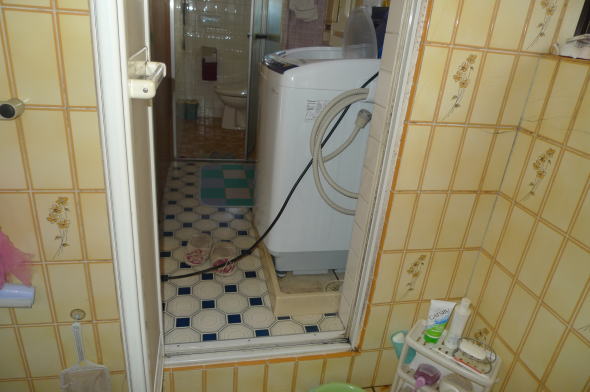
At what (x,y) coordinates should I click in order to perform the action: click on toilet. Please return your answer as a coordinate pair (x, y). This screenshot has height=392, width=590. Looking at the image, I should click on (232, 94).